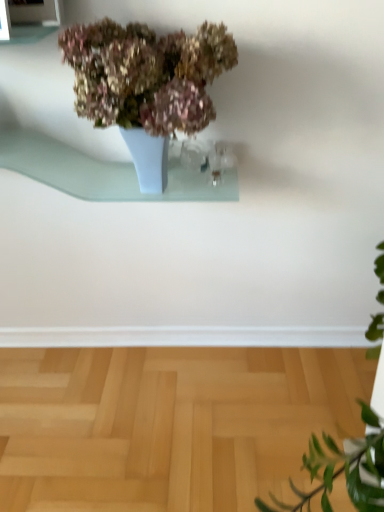
The height and width of the screenshot is (512, 384). I want to click on light wood parquet floor at lower center, so click(168, 424).

The height and width of the screenshot is (512, 384). I want to click on light wood parquet floor at lower center, so click(168, 424).

Is light blue glass shelf at upper center not within matte ceramic vase at upper center?

Actually, light blue glass shelf at upper center is within matte ceramic vase at upper center.

From the image's perspective, between light blue glass shelf at upper center and matte ceramic vase at upper center, which one is located above?

matte ceramic vase at upper center is shown above in the image.

Between light blue glass shelf at upper center and matte ceramic vase at upper center, which one has larger size?

Bigger between the two is matte ceramic vase at upper center.

Measure the distance from matte ceramic vase at upper center to light wood parquet floor at lower center.

matte ceramic vase at upper center and light wood parquet floor at lower center are 37.51 inches apart.

Based on their sizes in the image, would you say matte ceramic vase at upper center is bigger or smaller than light wood parquet floor at lower center?

Considering their sizes, matte ceramic vase at upper center takes up less space than light wood parquet floor at lower center.

Could light wood parquet floor at lower center be considered to be inside matte ceramic vase at upper center?

No, light wood parquet floor at lower center is not inside matte ceramic vase at upper center.

Is matte ceramic vase at upper center with light wood parquet floor at lower center?

There is a gap between matte ceramic vase at upper center and light wood parquet floor at lower center.

Does light wood parquet floor at lower center have a larger size compared to matte ceramic vase at upper center?

Correct, light wood parquet floor at lower center is larger in size than matte ceramic vase at upper center.

From the image's perspective, is light wood parquet floor at lower center beneath matte ceramic vase at upper center?

Yes, from the image's perspective, light wood parquet floor at lower center is below matte ceramic vase at upper center.

Is light wood parquet floor at lower center turned away from matte ceramic vase at upper center?

No.

From the image's perspective, is light blue glass shelf at upper center above light wood parquet floor at lower center?

Yes.

Is light blue glass shelf at upper center not near light wood parquet floor at lower center?

No, light blue glass shelf at upper center is not far away from light wood parquet floor at lower center.

Which is correct: light blue glass shelf at upper center is inside light wood parquet floor at lower center, or outside of it?

light blue glass shelf at upper center is not inside light wood parquet floor at lower center, it's outside.

Considering the sizes of light blue glass shelf at upper center and light wood parquet floor at lower center in the image, is light blue glass shelf at upper center wider or thinner than light wood parquet floor at lower center?

Considering their sizes, light blue glass shelf at upper center looks slimmer than light wood parquet floor at lower center.

How many degrees apart are the facing directions of light wood parquet floor at lower center and light blue glass shelf at upper center?

They differ by 90.1 degrees in their facing directions.

Between light wood parquet floor at lower center and light blue glass shelf at upper center, which one has larger size?

Bigger between the two is light wood parquet floor at lower center.

From a real-world perspective, is light wood parquet floor at lower center located higher than light blue glass shelf at upper center?

Actually, light wood parquet floor at lower center is physically below light blue glass shelf at upper center in the real world.

Can you confirm if light wood parquet floor at lower center is positioned to the right of light blue glass shelf at upper center?

Yes.

Which is in front, point (93, 88) or point (123, 185)?

The point (93, 88) is in front.

Measure the distance between matte ceramic vase at upper center and light blue glass shelf at upper center.

matte ceramic vase at upper center is 10.88 inches away from light blue glass shelf at upper center.

Is matte ceramic vase at upper center located outside light blue glass shelf at upper center?

Absolutely, matte ceramic vase at upper center is external to light blue glass shelf at upper center.

You are a GUI agent. You are given a task and a screenshot of the screen. Output one action in this format:
    pyautogui.click(x=<x>, y=<y>)
    Task: Click on the houseplant in front of the light blue glass shelf at upper center
    The image size is (384, 512).
    Given the screenshot: What is the action you would take?
    pyautogui.click(x=146, y=85)

The width and height of the screenshot is (384, 512). What are the coordinates of `houseplant located above the light wood parquet floor at lower center (from a real-world perspective)` in the screenshot? It's located at (146, 85).

Estimate the real-world distances between objects in this image. Which object is further from matte ceramic vase at upper center, light wood parquet floor at lower center or light blue glass shelf at upper center?

→ light wood parquet floor at lower center lies further to matte ceramic vase at upper center than the other object.

Looking at the image, which one is located further to light blue glass shelf at upper center, matte ceramic vase at upper center or light wood parquet floor at lower center?

light wood parquet floor at lower center lies further to light blue glass shelf at upper center than the other object.

Looking at this image, which object lies further to the anchor point matte ceramic vase at upper center, light blue glass shelf at upper center or light wood parquet floor at lower center?

The object further to matte ceramic vase at upper center is light wood parquet floor at lower center.

Based on their spatial positions, is light wood parquet floor at lower center or matte ceramic vase at upper center further from light blue glass shelf at upper center?

The object further to light blue glass shelf at upper center is light wood parquet floor at lower center.

When comparing their distances from light wood parquet floor at lower center, does light blue glass shelf at upper center or matte ceramic vase at upper center seem closer?

light blue glass shelf at upper center lies closer to light wood parquet floor at lower center than the other object.

When comparing their distances from light wood parquet floor at lower center, does matte ceramic vase at upper center or light blue glass shelf at upper center seem further?

Based on the image, matte ceramic vase at upper center appears to be further to light wood parquet floor at lower center.

Where is `window sill between matte ceramic vase at upper center and light wood parquet floor at lower center in the vertical direction`? window sill between matte ceramic vase at upper center and light wood parquet floor at lower center in the vertical direction is located at coordinates coord(103,172).